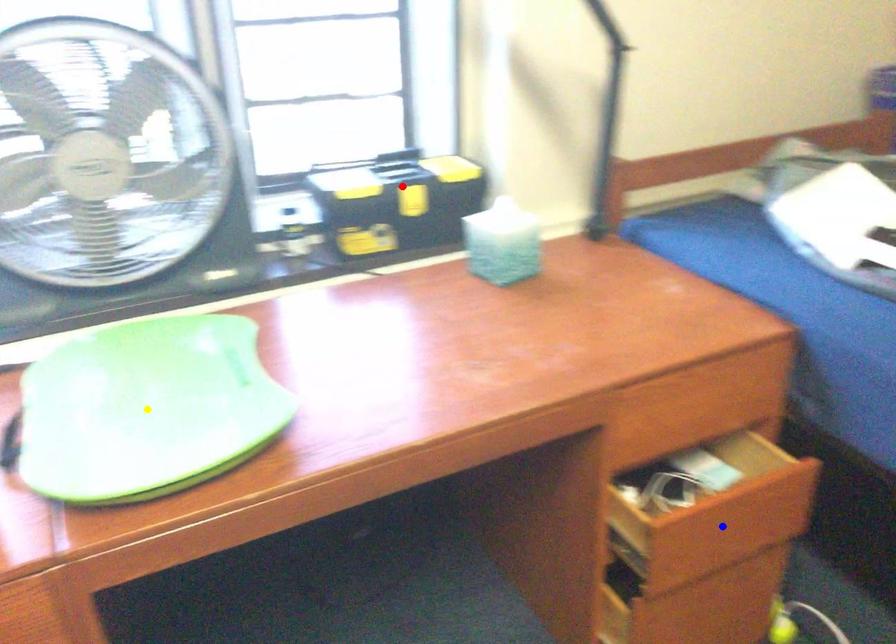
Order these from nearest to farthest:
- red point
- blue point
- yellow point

yellow point < blue point < red point